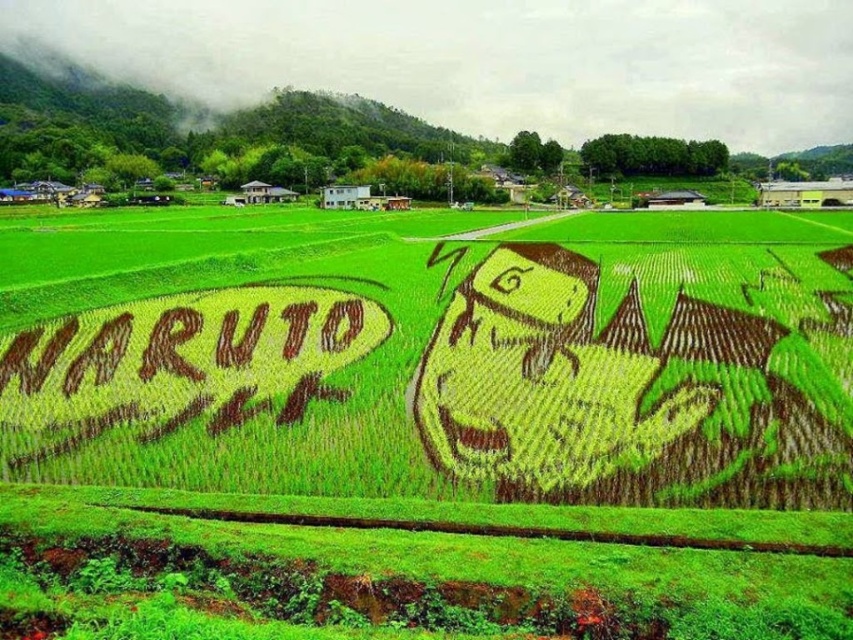
Between green grass at center and brown grass at left, which one is positioned higher?

Positioned higher is green grass at center.

Can you confirm if green grass at center is positioned above brown grass at left?

Yes.

Does point (163, 572) lie behind point (109, 410)?

That is False.

You are a GUI agent. You are given a task and a screenshot of the screen. Output one action in this format:
    pyautogui.click(x=<x>, y=<y>)
    Task: Click on the green grass at center
    The image size is (853, 640).
    Given the screenshot: What is the action you would take?
    pyautogui.click(x=426, y=422)